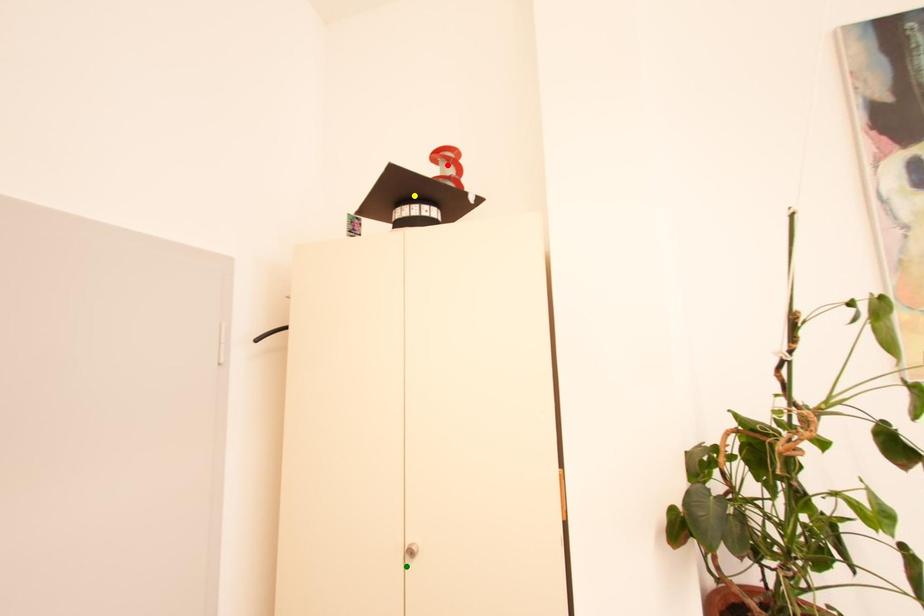
Order these from nearest to farthest:
A) green point
B) red point
C) yellow point

green point → yellow point → red point